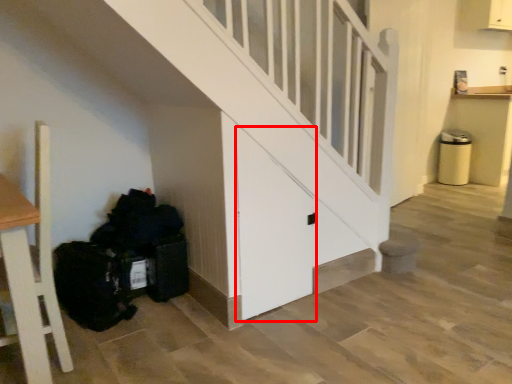
Question: From the image's perspective, where is door (annotated by the red box) located relative to garbage?

Choices:
 (A) below
 (B) above

Answer: (B)